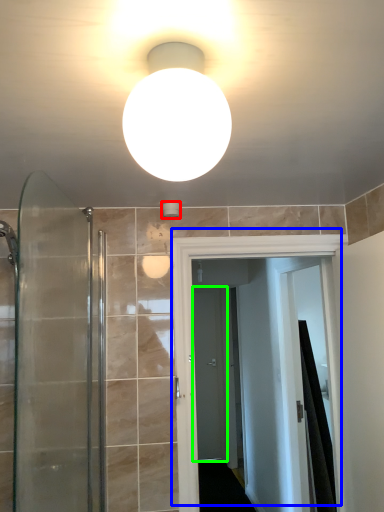
Question: Based on their relative distances, which object is farther from fixture (highlighted by a red box)? Choose from door (highlighted by a blue box) and screen door (highlighted by a green box).

Choices:
 (A) door
 (B) screen door

Answer: (B)